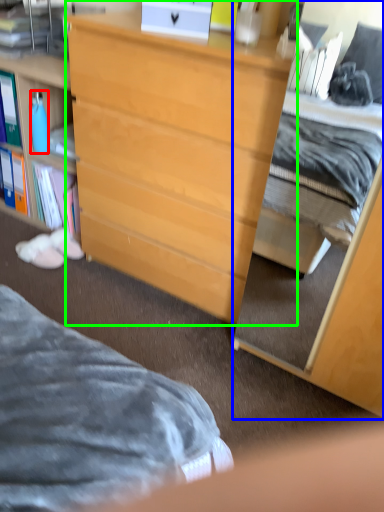
Question: Which is nearer to the bottle (highlighted by a red box)? cabinetry (highlighted by a blue box) or desk (highlighted by a green box).

Choices:
 (A) cabinetry
 (B) desk

Answer: (B)